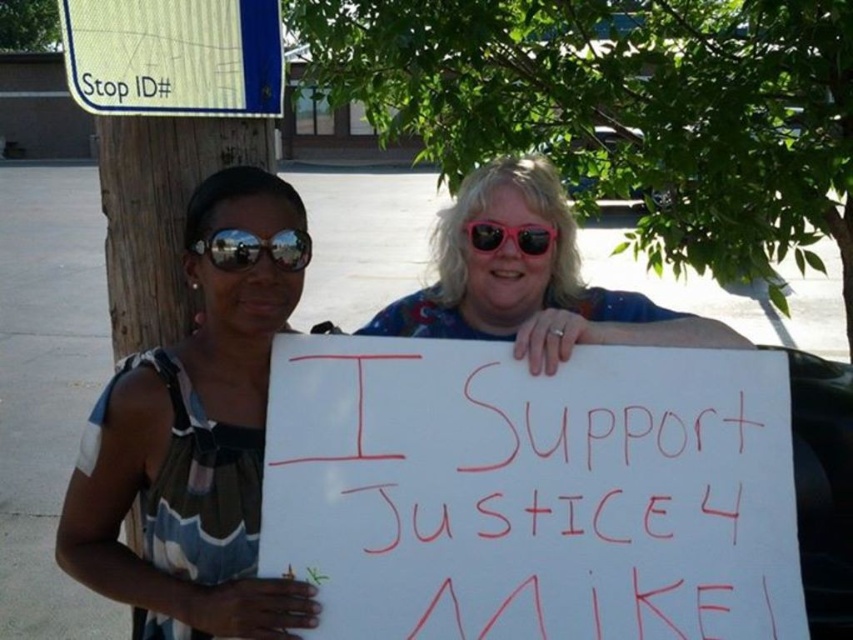
Question: Does white paper sign at center have a greater width compared to pink plastic sunglasses at center?

Choices:
 (A) yes
 (B) no

Answer: (A)

Question: Is reflective plastic goggles at center closer to camera compared to pink reflective sunglasses at center?

Choices:
 (A) no
 (B) yes

Answer: (B)

Question: Is white paper sign at center to the left of matte black sunglasses at left from the viewer's perspective?

Choices:
 (A) yes
 (B) no

Answer: (B)

Question: Which object is positioned closest to the matte black sunglasses at left?

Choices:
 (A) pink reflective sunglasses at center
 (B) green striped street sign at upper left
 (C) white paper sign at center

Answer: (C)

Question: Estimate the real-world distances between objects in this image. Which object is closer to the matte black sunglasses at left?

Choices:
 (A) white paper sign at center
 (B) pink reflective sunglasses at center
 (C) reflective plastic goggles at center

Answer: (C)

Question: Which point is closer to the camera taking this photo?

Choices:
 (A) (285, 253)
 (B) (259, 106)
 (C) (540, 224)
 (D) (281, 540)

Answer: (D)